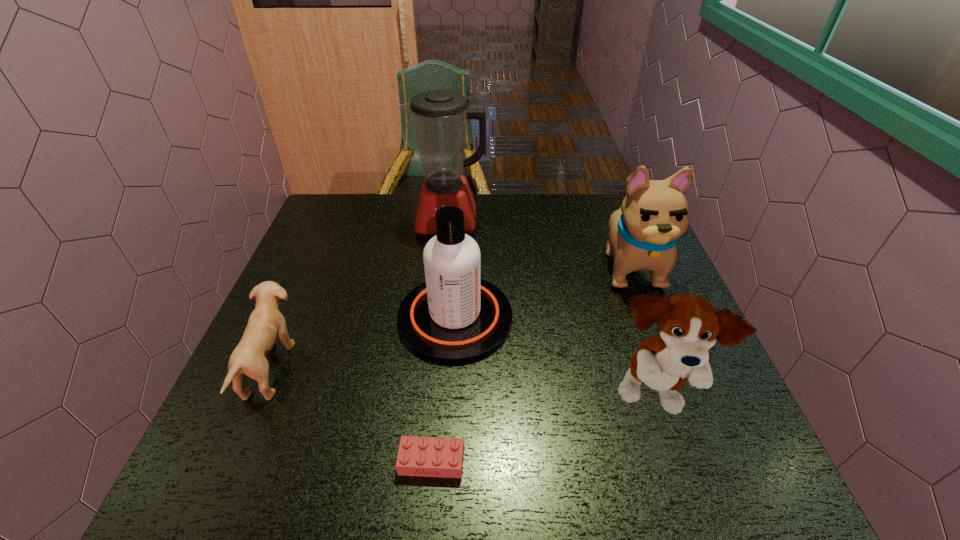
Image resolution: width=960 pixels, height=540 pixels. Find the location of `vacant region at the far right corner of the desktop`. vacant region at the far right corner of the desktop is located at coordinates (595, 215).

Where is `empty space between the leftmost puppy and the cleansing agent`? The height and width of the screenshot is (540, 960). empty space between the leftmost puppy and the cleansing agent is located at coordinates (363, 343).

Image resolution: width=960 pixels, height=540 pixels. What are the coordinates of `free space between the farthest puppy and the cleansing agent` in the screenshot? It's located at (542, 292).

You are a GUI agent. You are given a task and a screenshot of the screen. Output one action in this format:
    pyautogui.click(x=<x>, y=<y>)
    Task: Click on the unoccupied position between the leftmost object and the tallest object
    The height and width of the screenshot is (540, 960).
    Given the screenshot: What is the action you would take?
    [359, 295]

Identify the location of vacant point located between the shortest puppy and the blender. (359, 295).

Find the location of a particular element. The image size is (960, 540). vacant area that lies between the leftmost puppy and the cleansing agent is located at coordinates (363, 343).

Identify the location of vacant space that's between the leftmost object and the shortest object. This screenshot has width=960, height=540. (351, 415).

Image resolution: width=960 pixels, height=540 pixels. Identify the location of object that is the third nearest to the farthest puppy. (439, 117).

Where is `the fifth closest object to the cleansing agent`? This screenshot has width=960, height=540. the fifth closest object to the cleansing agent is located at coordinates (643, 233).

This screenshot has height=540, width=960. I want to click on puppy that stands as the third closest to the shortest object, so pyautogui.click(x=643, y=233).